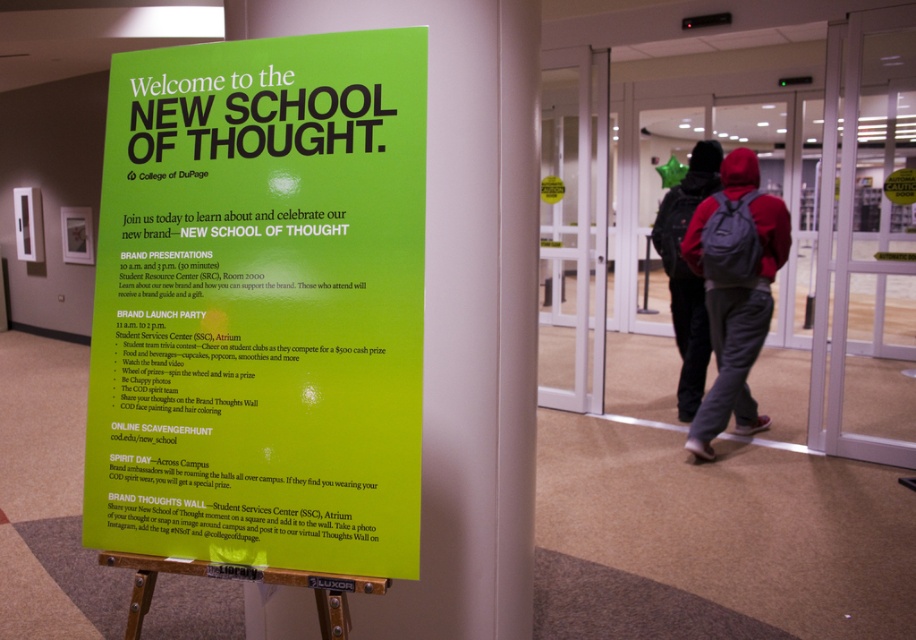
You are a visitor carrying a large box that is 1.5 meters wide. You are standing in front of the green paper sign at center and want to walk past it to the hallway entrance behind the sign. Can you pass through the area between the sign and the wall without tilting the box?

The distance between the green paper sign at center and the viewer is 1.32 meters. Since the box is 1.5 meters wide, it is wider than the available space, so you cannot pass through without tilting the box.

You are a visitor at the College of DuPage and see the green paper sign at center and the red fleece hoodie at center. Which object is positioned more to the left?

The green paper sign at center is positioned more to the left than the red fleece hoodie at center.

You are a student in a hurry and see the green paper sign at center and dark gray backpack at center. Which object is shorter?

The green paper sign at center is shorter than the dark gray backpack at center.